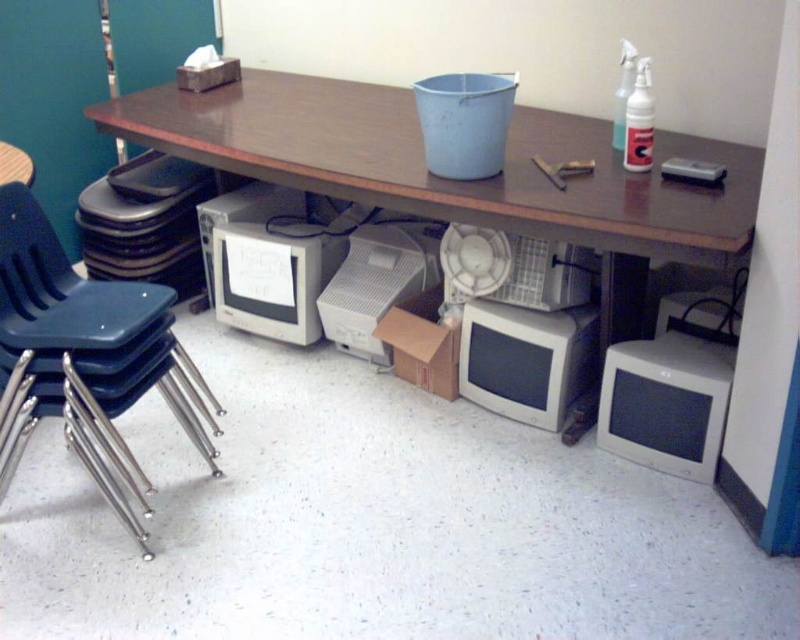
Does matte gray monitor at lower center appear on the right side of clear plastic spray bottle at upper right?

Incorrect, matte gray monitor at lower center is not on the right side of clear plastic spray bottle at upper right.

This screenshot has height=640, width=800. Find the location of `matte gray monitor at lower center`. matte gray monitor at lower center is located at coordinates (528, 358).

Describe the element at coordinates (528, 358) in the screenshot. This screenshot has width=800, height=640. I see `matte gray monitor at lower center` at that location.

In the scene shown: Who is shorter, matte gray monitor at lower center or white plastic spray bottle at upper right?

Standing shorter between the two is white plastic spray bottle at upper right.

Does point (546, 365) come closer to viewer compared to point (640, 166)?

No, it is not.

Find the location of a particular element. matte gray monitor at lower center is located at coordinates (528, 358).

Can you confirm if matte gray monitor at center is bigger than clear plastic spray bottle at upper right?

Yes.

Does point (298, 292) come in front of point (616, 122)?

No, (298, 292) is further to viewer.

This screenshot has width=800, height=640. I want to click on matte gray monitor at center, so (274, 276).